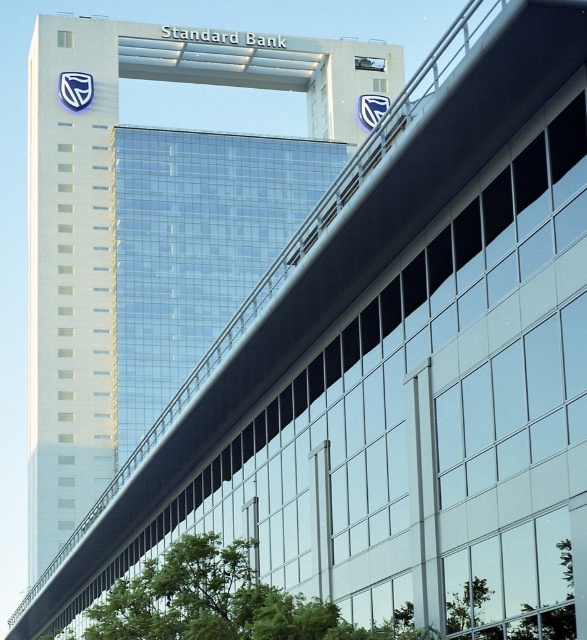
Is glassy blue skyscraper at upper center closer to camera compared to transparent glass building at center?

Yes, it is.

The width and height of the screenshot is (587, 640). What do you see at coordinates (119, 237) in the screenshot? I see `glassy blue skyscraper at upper center` at bounding box center [119, 237].

The height and width of the screenshot is (640, 587). I want to click on glassy blue skyscraper at upper center, so click(119, 237).